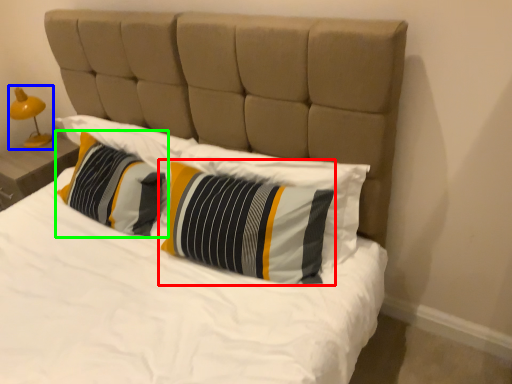
Question: Which object is the closest to the pillow (highlighted by a red box)? Choose among these: bedside lamp (highlighted by a blue box) or pillow (highlighted by a green box).

Choices:
 (A) bedside lamp
 (B) pillow

Answer: (B)